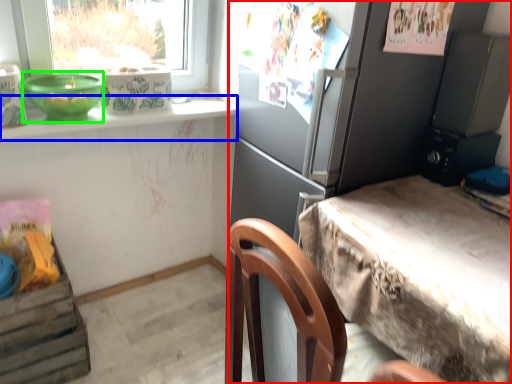
Question: Based on their relative distances, which object is farther from cabinetry (highlighted by a red box)? Choose from window sill (highlighted by a blue box) and bowl (highlighted by a green box).

Choices:
 (A) window sill
 (B) bowl

Answer: (B)